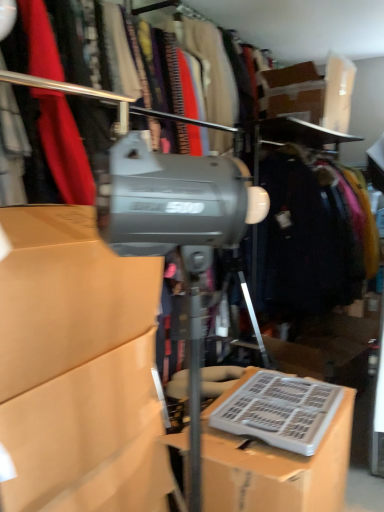
Question: Could you tell me if dark blue fabric coat at right is turned towards matte cardboard box at center, which is counted as the first box, starting from the left?

Choices:
 (A) yes
 (B) no

Answer: (B)

Question: Is dark blue fabric coat at right positioned beyond the bounds of matte cardboard box at center, which is the second box from right to left?

Choices:
 (A) no
 (B) yes

Answer: (B)

Question: Does dark blue fabric coat at right have a smaller size compared to matte cardboard box at center, which is the second box from right to left?

Choices:
 (A) yes
 (B) no

Answer: (B)

Question: From a real-world perspective, is dark blue fabric coat at right on top of matte cardboard box at center, which is the second box from right to left?

Choices:
 (A) yes
 (B) no

Answer: (A)

Question: Is there a large distance between dark blue fabric coat at right and matte cardboard box at center, which is counted as the first box, starting from the left?

Choices:
 (A) yes
 (B) no

Answer: (A)

Question: Considering the relative positions of matte gray tripod at center and matte cardboard box at center, which is the second box from right to left, in the image provided, is matte gray tripod at center to the left or to the right of matte cardboard box at center, which is the second box from right to left,?

Choices:
 (A) left
 (B) right

Answer: (B)

Question: Is matte gray tripod at center taller or shorter than matte cardboard box at center, which is counted as the first box, starting from the left?

Choices:
 (A) short
 (B) tall

Answer: (A)

Question: From the image's perspective, is matte gray tripod at center positioned above or below matte cardboard box at center, which is counted as the first box, starting from the left?

Choices:
 (A) above
 (B) below

Answer: (A)

Question: From a real-world perspective, is matte gray tripod at center physically located above or below matte cardboard box at center, which is the second box from right to left?

Choices:
 (A) below
 (B) above

Answer: (B)

Question: Is matte cardboard box at center, which is the second box from right to left, inside the boundaries of white plastic keyboard at lower right, or outside?

Choices:
 (A) inside
 (B) outside

Answer: (B)

Question: In terms of height, does matte cardboard box at center, which is counted as the first box, starting from the left, look taller or shorter compared to white plastic keyboard at lower right?

Choices:
 (A) tall
 (B) short

Answer: (A)

Question: From the image's perspective, is matte cardboard box at center, which is counted as the first box, starting from the left, located above or below white plastic keyboard at lower right?

Choices:
 (A) above
 (B) below

Answer: (A)

Question: Considering the positions of matte cardboard box at center, which is the second box from right to left, and white plastic keyboard at lower right in the image, is matte cardboard box at center, which is the second box from right to left, wider or thinner than white plastic keyboard at lower right?

Choices:
 (A) thin
 (B) wide

Answer: (A)

Question: Considering the relative positions of white plastic keyboard at lower right and matte cardboard box at center, which is counted as the first box, starting from the left, in the image provided, is white plastic keyboard at lower right to the left or to the right of matte cardboard box at center, which is counted as the first box, starting from the left,?

Choices:
 (A) right
 (B) left

Answer: (A)

Question: Is white plastic keyboard at lower right taller or shorter than matte cardboard box at center, which is the second box from right to left?

Choices:
 (A) tall
 (B) short

Answer: (B)